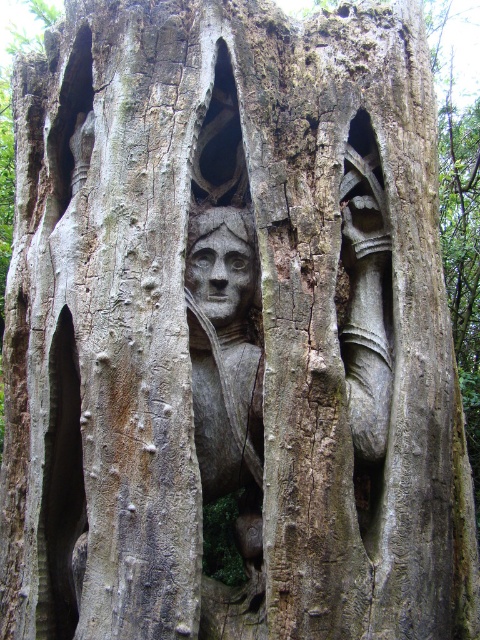
From the picture: Which is above, smooth wood carving at center or matte stone face at center?

smooth wood carving at center

Is the position of smooth wood carving at center less distant than that of matte stone face at center?

Yes, it is.

In order to click on smooth wood carving at center in this screenshot , I will do `click(220, 144)`.

Can you confirm if carved wood face at center is positioned to the right of matte stone face at center?

Yes, carved wood face at center is to the right of matte stone face at center.

Which is behind, point (252, 452) or point (231, 237)?

Positioned behind is point (231, 237).

Which is in front, point (197, 314) or point (255, 273)?

Point (197, 314)

Locate an element on the screen. The image size is (480, 640). carved wood face at center is located at coordinates (228, 364).

Is carved wood face at center taller than smooth wood carving at center?

Yes.

Between point (195, 352) and point (214, 120), which one is positioned behind?

The point (214, 120) is behind.

At what (x,y) coordinates should I click in order to perform the action: click on carved wood face at center. Please return your answer as a coordinate pair (x, y). This screenshot has width=480, height=640. Looking at the image, I should click on (228, 364).